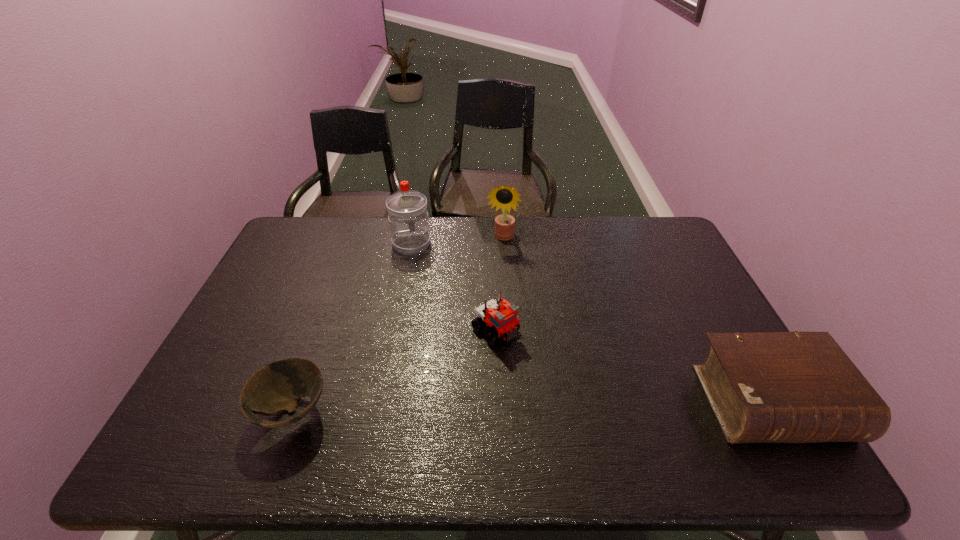
Image resolution: width=960 pixels, height=540 pixels. I want to click on free space located on the face of the sunflower, so click(496, 260).

Locate an element on the screen. Image resolution: width=960 pixels, height=540 pixels. vacant space located 0.230m on the face of the sunflower is located at coordinates (490, 293).

Locate an element on the screen. Image resolution: width=960 pixels, height=540 pixels. vacant space located on the face of the sunflower is located at coordinates (490, 293).

This screenshot has height=540, width=960. In order to click on free spot located 0.080m on the handle side of the water bottle in this screenshot , I will do `click(420, 269)`.

Locate an element on the screen. The width and height of the screenshot is (960, 540). vacant space located 0.320m on the handle side of the water bottle is located at coordinates (438, 321).

The image size is (960, 540). What are the coordinates of `vacant point located on the handle side of the water bottle` in the screenshot? It's located at (427, 289).

Find the location of a particular element. This screenshot has height=540, width=960. sunflower at the far edge is located at coordinates (504, 197).

You are a GUI agent. You are given a task and a screenshot of the screen. Output one action in this format:
    pyautogui.click(x=<x>, y=<y>)
    Task: Click on the water bottle located in the far edge section of the desktop
    Image resolution: width=960 pixels, height=540 pixels.
    Given the screenshot: What is the action you would take?
    pyautogui.click(x=407, y=209)

Identify the location of bowl at the near edge. This screenshot has height=540, width=960. (278, 386).

Find the location of a particular element. The height and width of the screenshot is (540, 960). Bible located at the near edge is located at coordinates (764, 387).